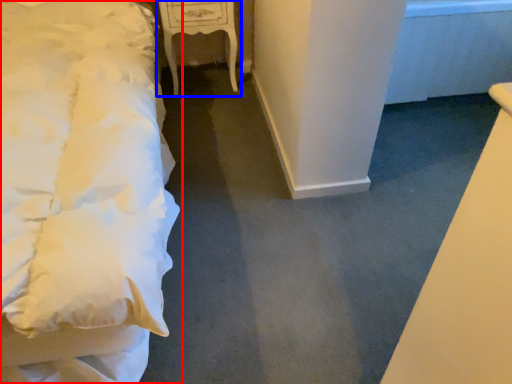
Question: Which point is closer to the camera, bed (highlighted by a red box) or furniture (highlighted by a blue box)?

Choices:
 (A) bed
 (B) furniture

Answer: (A)